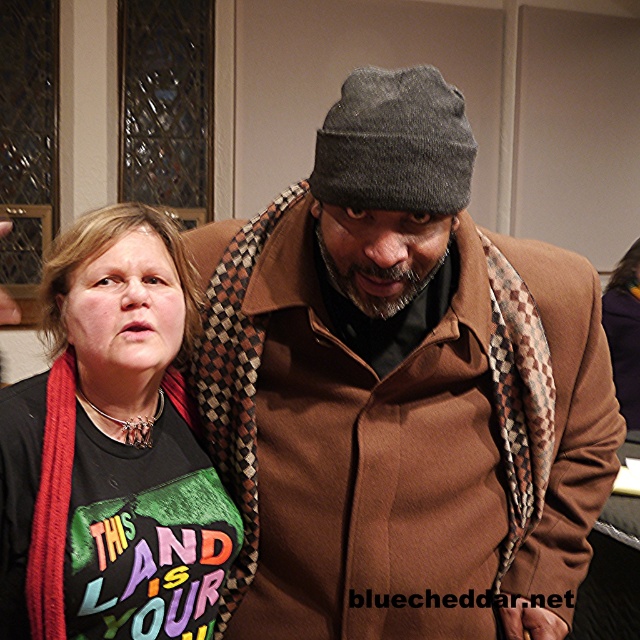
You are standing in the scene and want to move from the point at coordinates point [19,408] to the point at coordinates point [360,116]. Which direction should you face to walk towards the second point?

To move from point [19,408] to point [360,116], you should face towards the upper left direction since point [360,116] is located in that direction relative to point [19,408].